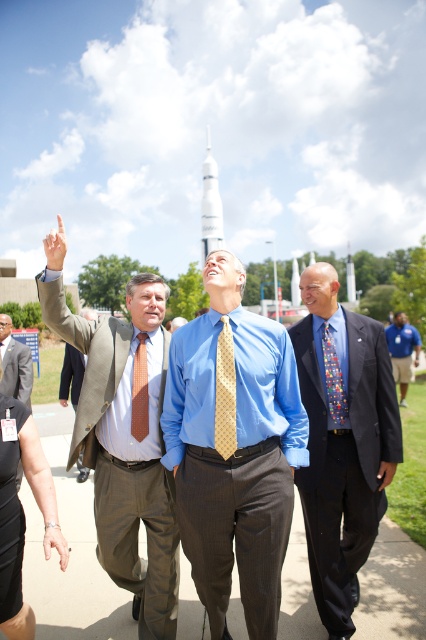
Question: Which object is closer to the camera taking this photo?

Choices:
 (A) matte brown suit at center
 (B) light brown leather jacket at center
 (C) white glossy rocket at center

Answer: (A)

Question: Does matte gray suit at center have a larger size compared to light brown leather jacket at center?

Choices:
 (A) yes
 (B) no

Answer: (B)

Question: Does matte brown suit at center appear under multicolored fabric tie at center?

Choices:
 (A) yes
 (B) no

Answer: (A)

Question: Which object appears closest to the camera in this image?

Choices:
 (A) white glossy rocket at center
 (B) blue pinstripe shirt at center
 (C) light brown leather jacket at center

Answer: (B)

Question: Can you confirm if matte gold tie at center is positioned to the left of matte skin hand at upper left?

Choices:
 (A) yes
 (B) no

Answer: (B)

Question: Which object is farther from the camera taking this photo?

Choices:
 (A) matte skin hand at upper left
 (B) dark blue suit at center
 (C) matte brown suit at center

Answer: (A)